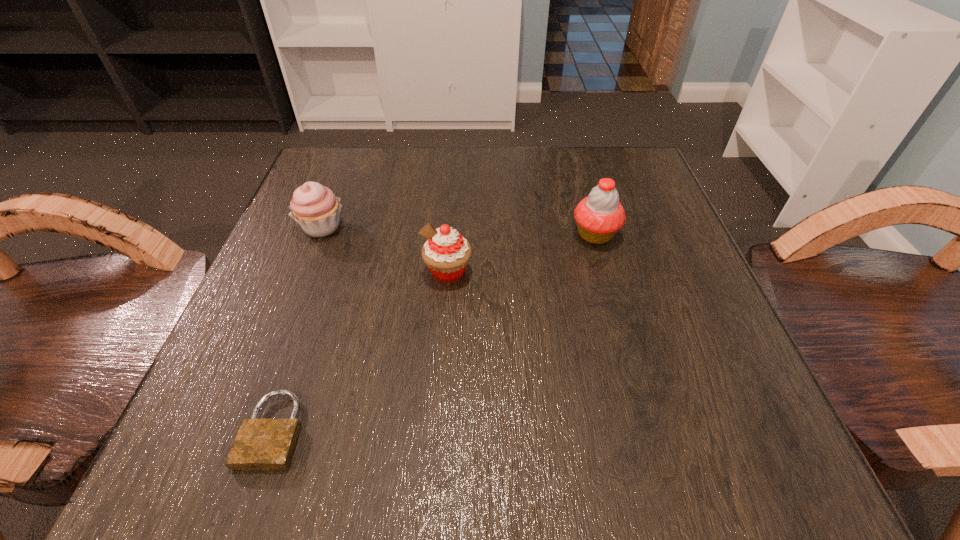
Find the location of a particular element. The width and height of the screenshot is (960, 540). cupcake that is at the left edge is located at coordinates (315, 207).

Find the location of a particular element. padlock located at the left edge is located at coordinates (260, 443).

Where is `object at the right edge`? The height and width of the screenshot is (540, 960). object at the right edge is located at coordinates (599, 216).

At what (x,y) coordinates should I click in order to perform the action: click on object that is positioned at the near left corner. Please return your answer as a coordinate pair (x, y). The height and width of the screenshot is (540, 960). Looking at the image, I should click on (260, 443).

This screenshot has width=960, height=540. I want to click on free space at the far edge of the desktop, so click(x=444, y=199).

I want to click on vacant space at the near edge of the desktop, so click(552, 475).

Find the location of a particular element. This screenshot has height=540, width=960. blank area at the left edge is located at coordinates (266, 357).

In the image, there is a desktop. Identify the location of vacant space at the right edge. (670, 215).

Locate an element on the screen. The image size is (960, 540). vacant space at the far left corner is located at coordinates (375, 202).

Image resolution: width=960 pixels, height=540 pixels. In the image, there is a desktop. Identify the location of blank space at the far right corner. (613, 171).